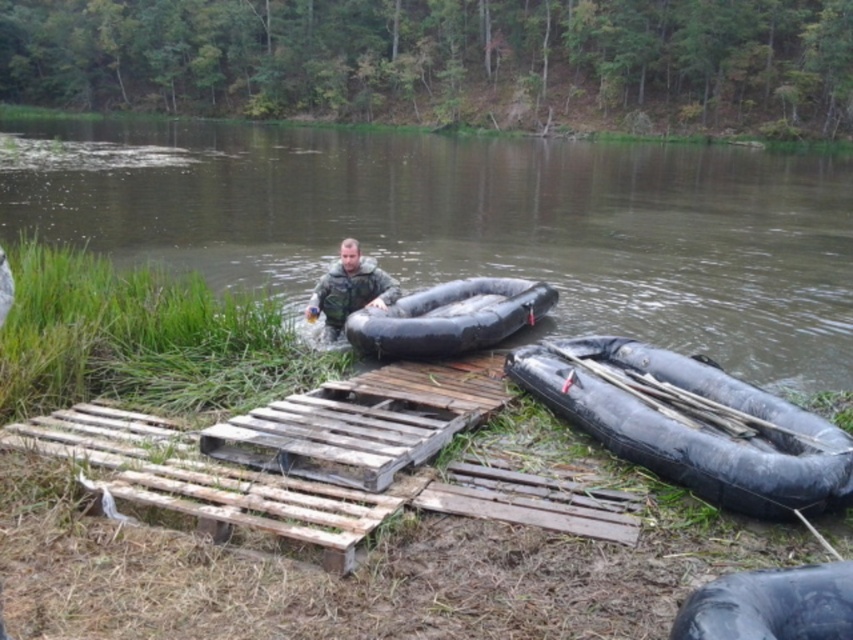
Question: Which object is the farthest from the black rubber tire at lower right?

Choices:
 (A) black rubber canoe at right
 (B) camouflage fabric man at center

Answer: (B)

Question: Does black rubber canoe at right have a smaller size compared to camouflage fabric man at center?

Choices:
 (A) yes
 (B) no

Answer: (B)

Question: Which object appears closest to the camera in this image?

Choices:
 (A) black rubber tire at lower right
 (B) black rubber canoe at center

Answer: (A)

Question: Is black rubber canoe at center thinner than camouflage fabric man at center?

Choices:
 (A) yes
 (B) no

Answer: (B)

Question: Can you confirm if black rubber canoe at right is bigger than black rubber tire at lower right?

Choices:
 (A) yes
 (B) no

Answer: (A)

Question: Based on their relative distances, which object is nearer to the black rubber canoe at center?

Choices:
 (A) camouflage fabric man at center
 (B) black rubber tire at lower right

Answer: (A)